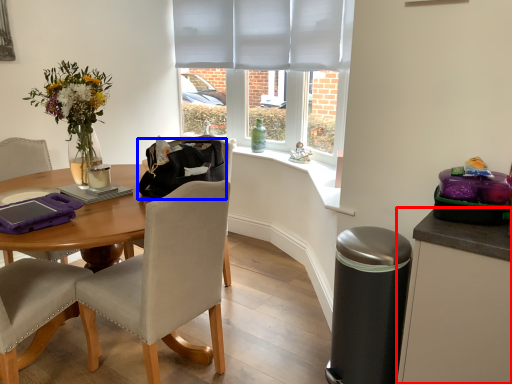
Question: Among these objects, which one is nearest to the camera, cabinetry (highlighted by a red box) or handbag (highlighted by a blue box)?

Choices:
 (A) cabinetry
 (B) handbag

Answer: (A)